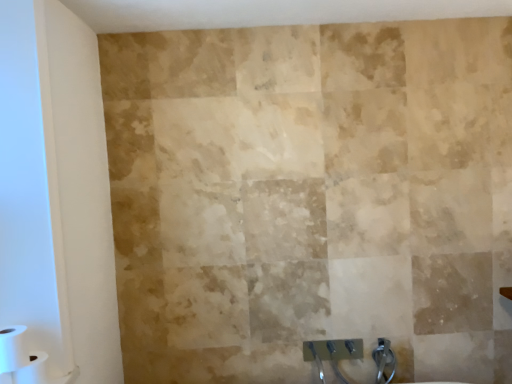
Question: Is white matte toilet paper at lower left, the 2th toilet paper from the top, spatially inside transparent glass door at left, or outside of it?

Choices:
 (A) outside
 (B) inside

Answer: (A)

Question: Relative to transparent glass door at left, is white matte toilet paper at lower left, arranged as the 1th toilet paper when ordered from the bottom, in front or behind?

Choices:
 (A) behind
 (B) front

Answer: (A)

Question: Based on their relative distances, which object is nearer to the white matte toilet paper at lower left, which is the 1th toilet paper in top-to-bottom order?

Choices:
 (A) white matte toilet paper at lower left, arranged as the 1th toilet paper when ordered from the bottom
 (B) transparent glass door at left

Answer: (A)

Question: Which object is positioned farthest from the transparent glass door at left?

Choices:
 (A) white matte toilet paper at lower left, the 2th toilet paper from the top
 (B) white matte toilet paper at lower left, which is the 1th toilet paper in top-to-bottom order

Answer: (A)